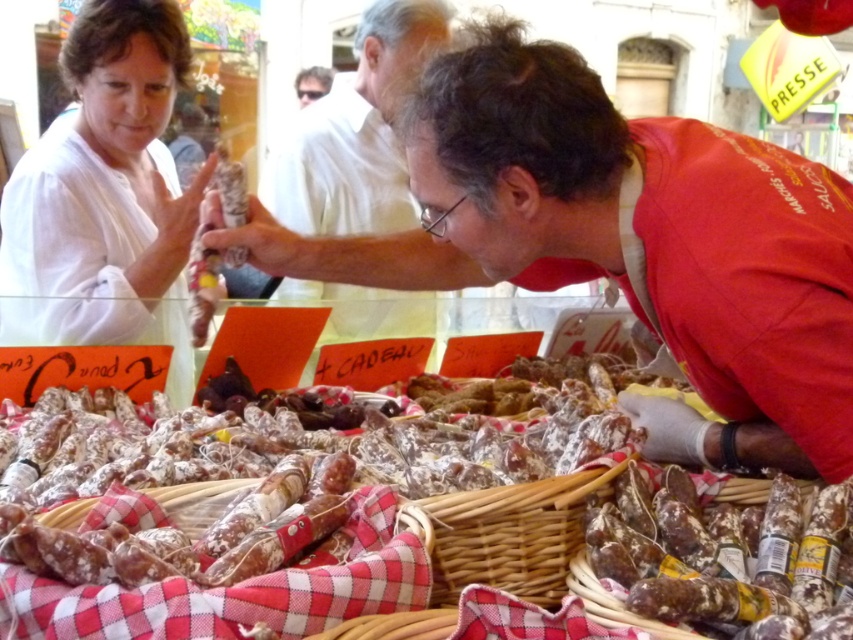
Which is in front, point (90, 316) or point (457, 563)?

Positioned in front is point (457, 563).

Between point (151, 86) and point (465, 561), which one is positioned behind?

The point (151, 86) is behind.

You are a GUI agent. You are given a task and a screenshot of the screen. Output one action in this format:
    pyautogui.click(x=<x>, y=<y>)
    Task: Click on the matte white shirt at upper left
    
    Given the screenshot: What is the action you would take?
    pyautogui.click(x=106, y=196)

Between shiny silver sausage at center and brown crinkled salami at center, which one appears on the left side from the viewer's perspective?

shiny silver sausage at center

What do you see at coordinates (328, 445) in the screenshot? The image size is (853, 640). I see `shiny silver sausage at center` at bounding box center [328, 445].

Between point (202, 465) and point (814, 557), which one is positioned behind?

The point (202, 465) is behind.

Where is `shiny silver sausage at center`? Image resolution: width=853 pixels, height=640 pixels. shiny silver sausage at center is located at coordinates (328, 445).

What do you see at coordinates (106, 196) in the screenshot? I see `matte white shirt at upper left` at bounding box center [106, 196].

Find the location of a particular element. This screenshot has width=853, height=640. matte white shirt at upper left is located at coordinates (106, 196).